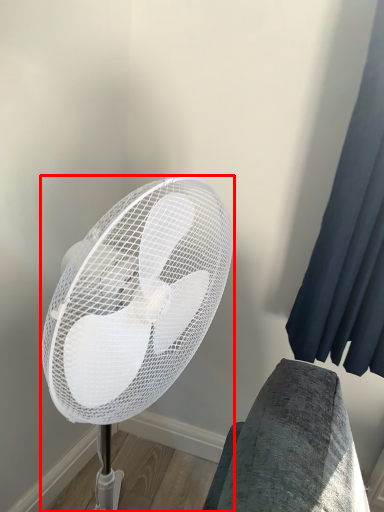
Question: Considering the relative positions of mechanical fan (annotated by the red box) and curtain in the image provided, where is mechanical fan (annotated by the red box) located with respect to the staircase?

Choices:
 (A) left
 (B) right

Answer: (A)